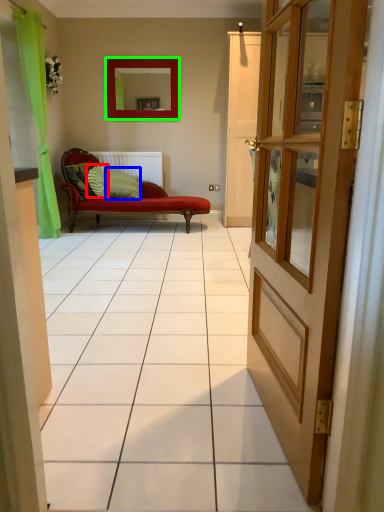
Question: Estimate the real-world distances between objects in this image. Which object is closer to pillow (highlighted by a red box), pillow (highlighted by a blue box) or mirror (highlighted by a green box)?

Choices:
 (A) pillow
 (B) mirror

Answer: (A)